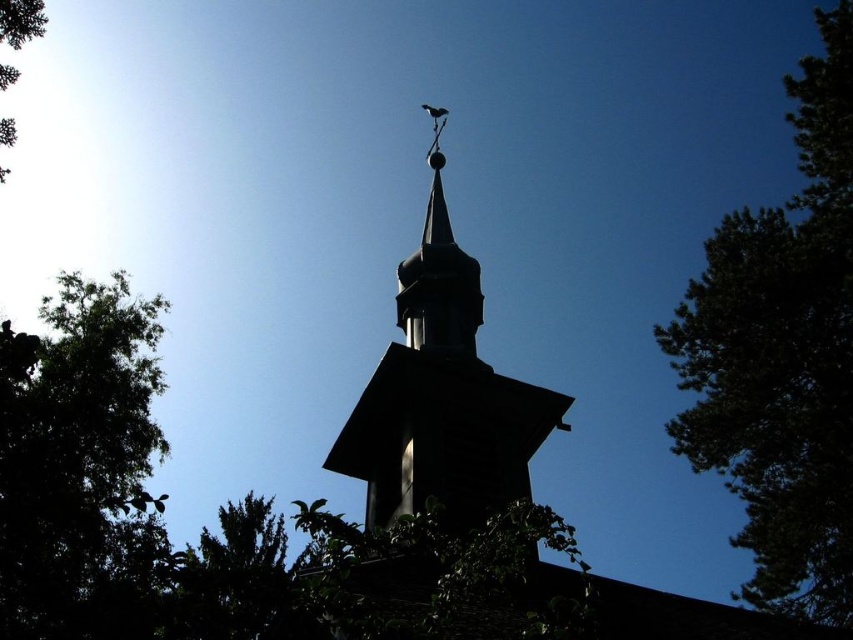
Can you confirm if green leafy tree at lower left is bigger than black wood steeple at center?

Incorrect, green leafy tree at lower left is not larger than black wood steeple at center.

Does green leafy tree at lower left have a lesser height compared to black wood steeple at center?

Indeed, green leafy tree at lower left has a lesser height compared to black wood steeple at center.

Is point (122, 372) in front of point (434, 452)?

That is False.

Locate an element on the screen. green leafy tree at lower left is located at coordinates (78, 465).

Between point (850, 230) and point (15, 76), which one is positioned in front?

Point (850, 230)

Is point (809, 182) positioned before point (12, 72)?

That is False.

The height and width of the screenshot is (640, 853). I want to click on green leafy tree at upper right, so click(x=782, y=355).

Which is in front, point (759, 292) or point (366, 481)?

Point (759, 292) is in front.

Is green leafy tree at upper right bigger than black wood steeple at center?

Yes, green leafy tree at upper right is bigger than black wood steeple at center.

Which is behind, point (802, 88) or point (405, 296)?

The point (405, 296) is more distant.

At what (x,y) coordinates should I click in order to perform the action: click on green leafy tree at upper right. Please return your answer as a coordinate pair (x, y). This screenshot has width=853, height=640. Looking at the image, I should click on (782, 355).